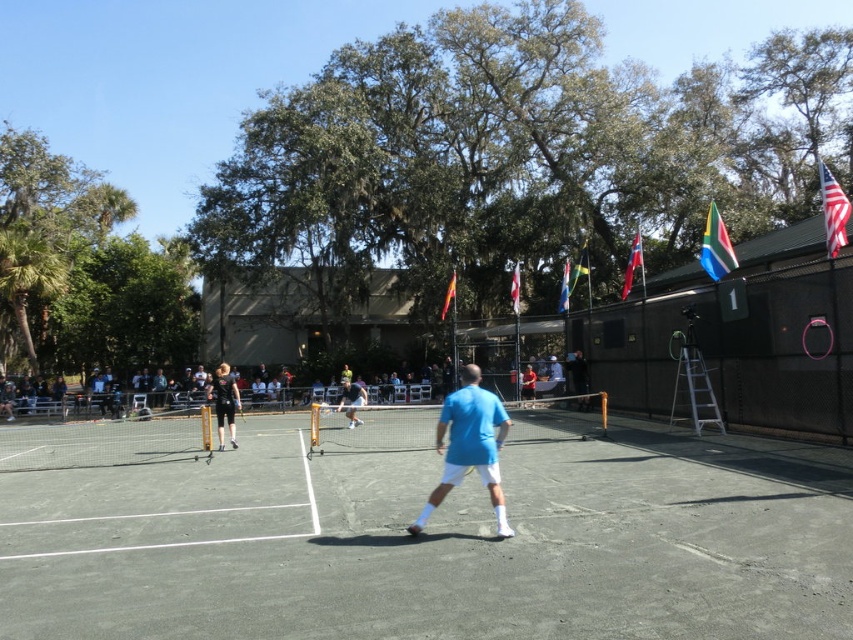
Question: Can you confirm if american flag at upper right is positioned to the left of blue fabric flag at upper center?

Choices:
 (A) no
 (B) yes

Answer: (A)

Question: Based on their relative distances, which object is nearer to the blue cotton shirt at center?

Choices:
 (A) matte blue shirt at center
 (B) black athletic wear at center

Answer: (A)

Question: Does american flag at upper right appear on the left side of red fabric flag at center?

Choices:
 (A) yes
 (B) no

Answer: (B)

Question: Considering the relative positions of concrete tennis court at center and matte blue shirt at center in the image provided, where is concrete tennis court at center located with respect to matte blue shirt at center?

Choices:
 (A) below
 (B) above

Answer: (A)

Question: Which of the following is the closest to the observer?

Choices:
 (A) (218, 419)
 (B) (451, 276)
 (C) (825, 164)

Answer: (A)

Question: Which point is closer to the camera taking this photo?

Choices:
 (A) (474, 428)
 (B) (515, 298)
 (C) (225, 369)
 (D) (445, 307)

Answer: (A)